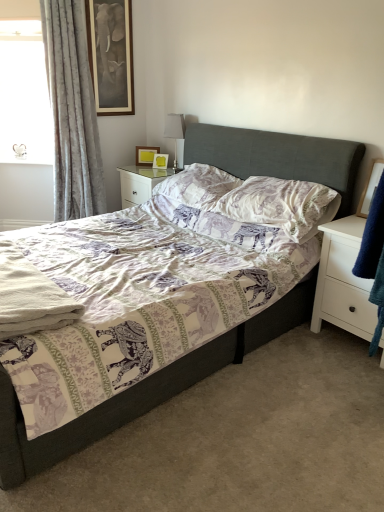
Find the location of a particular element. The image size is (384, 512). satin silver table lamp at upper center is located at coordinates (175, 131).

The image size is (384, 512). In order to click on textured gray bed at center in this screenshot , I will do `click(141, 390)`.

Image resolution: width=384 pixels, height=512 pixels. Describe the element at coordinates (72, 112) in the screenshot. I see `silky gray curtain at left` at that location.

The height and width of the screenshot is (512, 384). What do you see at coordinates (370, 187) in the screenshot?
I see `wooden picture frame at right, the first picture frame when ordered from right to left` at bounding box center [370, 187].

Find the location of a particular element. The width and height of the screenshot is (384, 512). purple elephant-patterned pillow at center, which is counted as the second pillow, starting from the front is located at coordinates (198, 186).

Can you confirm if silky gray curtain at left is wider than textured gray bed at center?

In fact, silky gray curtain at left might be narrower than textured gray bed at center.

From the image's perspective, is silky gray curtain at left above textured gray bed at center?

Indeed, from the image's perspective, silky gray curtain at left is shown above textured gray bed at center.

Is silky gray curtain at left not inside textured gray bed at center?

Yes, silky gray curtain at left is located beyond the bounds of textured gray bed at center.

Is point (46, 66) closer or farther from the camera than point (341, 200)?

Point (46, 66) is positioned farther from the camera compared to point (341, 200).

Considering their positions, is white glossy nightstand at center, placed as the second nightstand when sorted from right to left, located in front of or behind wooden picture frame at right, the second picture frame from the back?

In the image, white glossy nightstand at center, placed as the second nightstand when sorted from right to left, appears behind wooden picture frame at right, the second picture frame from the back.

From a real-world perspective, is white glossy nightstand at center, arranged as the 2th nightstand when viewed from the front, above or below wooden picture frame at right, the second picture frame from the back?

white glossy nightstand at center, arranged as the 2th nightstand when viewed from the front, is situated lower than wooden picture frame at right, the second picture frame from the back, in the real world.

Between white glossy nightstand at center, which ranks as the second nightstand in bottom-to-top order, and wooden picture frame at right, the 1th picture frame from the bottom, which one has less height?

wooden picture frame at right, the 1th picture frame from the bottom, is shorter.

From the image's perspective, is white glossy nightstand at center, which ranks as the second nightstand in bottom-to-top order, located above wooden picture frame at right, the first picture frame when ordered from right to left?

Yes.

Is silky gray curtain at left completely or partially inside wooden picture frame at right, the 1th picture frame from the bottom?

Definitely not — silky gray curtain at left is not inside wooden picture frame at right, the 1th picture frame from the bottom.

From the image's perspective, between wooden picture frame at right, the 1th picture frame from the bottom, and silky gray curtain at left, which one is located above?

silky gray curtain at left, from the image's perspective.

Based on the photo, in terms of height, does wooden picture frame at right, the first picture frame when ordered from right to left, look taller or shorter compared to silky gray curtain at left?

wooden picture frame at right, the first picture frame when ordered from right to left, is shorter than silky gray curtain at left.

In the scene shown: Considering the sizes of wooden picture frame at right, which is the 2th picture frame from top to bottom, and silky gray curtain at left in the image, is wooden picture frame at right, which is the 2th picture frame from top to bottom, wider or thinner than silky gray curtain at left?

Considering their sizes, wooden picture frame at right, which is the 2th picture frame from top to bottom, looks slimmer than silky gray curtain at left.

From the image's perspective, is printed fabric pillow at center, which is counted as the 1th pillow, starting from the front, above or below textured gray bed at center?

Clearly, from the image's perspective, printed fabric pillow at center, which is counted as the 1th pillow, starting from the front, is above textured gray bed at center.

Can you confirm if printed fabric pillow at center, acting as the 2th pillow starting from the back, is bigger than textured gray bed at center?

No.

Is point (251, 220) closer to camera compared to point (12, 401)?

No, (251, 220) is behind (12, 401).

Is the depth of printed fabric pillow at center, acting as the 2th pillow starting from the back, greater than that of textured gray bed at center?

Yes, printed fabric pillow at center, acting as the 2th pillow starting from the back, is behind textured gray bed at center.

Is printed fabric pillow at center, which is counted as the 1th pillow, starting from the front, not inside matte yellow picture frame at upper center, the first picture frame from the top?

Yes, printed fabric pillow at center, which is counted as the 1th pillow, starting from the front, is not within matte yellow picture frame at upper center, the first picture frame from the top.

Is printed fabric pillow at center, which is counted as the 1th pillow, starting from the front, oriented away from matte yellow picture frame at upper center, the first picture frame from the top?

No, printed fabric pillow at center, which is counted as the 1th pillow, starting from the front, is not facing away from matte yellow picture frame at upper center, the first picture frame from the top.

Is white glossy nightstand at center, the first nightstand viewed from the back, wider or thinner than satin silver table lamp at upper center?

Considering their sizes, white glossy nightstand at center, the first nightstand viewed from the back, looks broader than satin silver table lamp at upper center.

From a real-world perspective, is white glossy nightstand at center, which is the first nightstand from left to right, positioned above or below satin silver table lamp at upper center?

white glossy nightstand at center, which is the first nightstand from left to right, is below satin silver table lamp at upper center.

In the scene shown: Could you tell me if white glossy nightstand at center, which is the first nightstand from left to right, is facing satin silver table lamp at upper center?

No, white glossy nightstand at center, which is the first nightstand from left to right, does not turn towards satin silver table lamp at upper center.

You are a GUI agent. You are given a task and a screenshot of the screen. Output one action in this format:
    pyautogui.click(x=<x>, y=<y>)
    Task: Click on the nightstand that appears on the left of satin silver table lamp at upper center
    The width and height of the screenshot is (384, 512).
    Given the screenshot: What is the action you would take?
    pyautogui.click(x=140, y=183)

Between point (288, 183) and point (324, 253), which one is positioned behind?

Positioned behind is point (288, 183).

Which of these two, printed fabric pillow at center, acting as the 2th pillow starting from the back, or white matte nightstand at lower right, the 2th nightstand viewed from the top, is thinner?

Thinner between the two is printed fabric pillow at center, acting as the 2th pillow starting from the back.

From the image's perspective, relative to white matte nightstand at lower right, the second nightstand positioned from the left, is printed fabric pillow at center, which is counted as the 1th pillow, starting from the front, above or below?

From the image's perspective, printed fabric pillow at center, which is counted as the 1th pillow, starting from the front, appears above white matte nightstand at lower right, the second nightstand positioned from the left.

Identify the location of curtain above the textured gray bed at center (from a real-world perspective). (72, 112).

You are a GUI agent. You are given a task and a screenshot of the screen. Output one action in this format:
    pyautogui.click(x=<x>, y=<y>)
    Task: Click on the nightstand behind the wooden picture frame at right, the second picture frame from the back
    The image size is (384, 512).
    Given the screenshot: What is the action you would take?
    pyautogui.click(x=140, y=183)

From the image, which object appears to be nearer to textured gray bed at center, matte yellow picture frame at upper center, the first picture frame in the back-to-front sequence, or satin silver table lamp at upper center?

The object closer to textured gray bed at center is satin silver table lamp at upper center.

Looking at the image, which one is located closer to wooden picture frame at right, positioned as the first picture frame in front-to-back order, purple elephant-patterned pillow at center, which is counted as the second pillow, starting from the front, or silky gray curtain at left?

Among the two, purple elephant-patterned pillow at center, which is counted as the second pillow, starting from the front, is located nearer to wooden picture frame at right, positioned as the first picture frame in front-to-back order.

Based on their spatial positions, is wooden picture frame at right, the first picture frame when ordered from right to left, or printed fabric pillow at center, acting as the 2th pillow starting from the back, further from white glossy nightstand at center, arranged as the 2th nightstand when viewed from the front?

wooden picture frame at right, the first picture frame when ordered from right to left.

From the image, which object appears to be farther from purple elephant-patterned pillow at center, arranged as the first pillow when viewed from the back, wooden picture frame at right, the second picture frame from the back, or white matte nightstand at lower right, the second nightstand positioned from the left?

The object further to purple elephant-patterned pillow at center, arranged as the first pillow when viewed from the back, is wooden picture frame at right, the second picture frame from the back.

Estimate the real-world distances between objects in this image. Which object is closer to silky gray curtain at left, matte yellow picture frame at upper center, the first picture frame in the back-to-front sequence, or satin silver table lamp at upper center?

matte yellow picture frame at upper center, the first picture frame in the back-to-front sequence, lies closer to silky gray curtain at left than the other object.

Based on their spatial positions, is textured gray bed at center or silky gray curtain at left further from white matte nightstand at lower right, the 1th nightstand in the bottom-to-top sequence?

The object further to white matte nightstand at lower right, the 1th nightstand in the bottom-to-top sequence, is silky gray curtain at left.

Estimate the real-world distances between objects in this image. Which object is closer to printed fabric pillow at center, which is counted as the 1th pillow, starting from the front, purple elephant-patterned pillow at center, arranged as the first pillow when viewed from the back, or matte yellow picture frame at upper center, which is the second picture frame from front to back?

The object closer to printed fabric pillow at center, which is counted as the 1th pillow, starting from the front, is purple elephant-patterned pillow at center, arranged as the first pillow when viewed from the back.

Estimate the real-world distances between objects in this image. Which object is closer to satin silver table lamp at upper center, white matte nightstand at lower right, positioned as the first nightstand in right-to-left order, or matte yellow picture frame at upper center, arranged as the first picture frame when viewed from the left?

matte yellow picture frame at upper center, arranged as the first picture frame when viewed from the left.

This screenshot has width=384, height=512. In order to click on table lamp positioned between printed fabric pillow at center, which is counted as the 1th pillow, starting from the front, and matte yellow picture frame at upper center, which ranks as the 2th picture frame in bottom-to-top order, from near to far in this screenshot , I will do `click(175, 131)`.

Identify the location of picture frame between silky gray curtain at left and wooden picture frame at right, which is the 2th picture frame from top to bottom, from left to right. The height and width of the screenshot is (512, 384). (146, 155).

You are a GUI agent. You are given a task and a screenshot of the screen. Output one action in this format:
    pyautogui.click(x=<x>, y=<y>)
    Task: Click on the table lamp between printed fabric pillow at center, which is counted as the 1th pillow, starting from the front, and white glossy nightstand at center, arranged as the 2th nightstand when viewed from the front, along the z-axis
    The height and width of the screenshot is (512, 384).
    Given the screenshot: What is the action you would take?
    pyautogui.click(x=175, y=131)

Identify the location of table lamp between white matte nightstand at lower right, the 2th nightstand viewed from the top, and matte yellow picture frame at upper center, the first picture frame in the back-to-front sequence, from front to back. (175, 131).